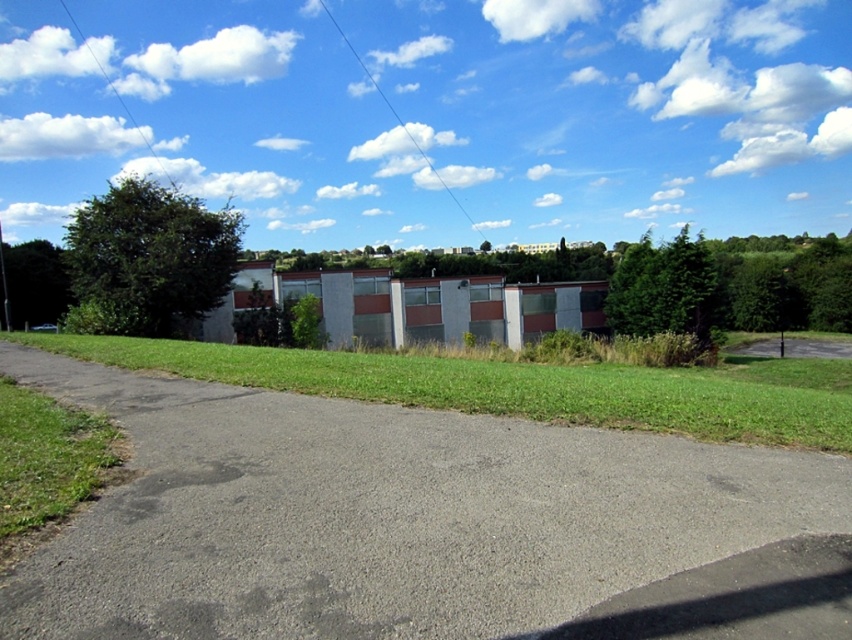
Question: Considering the real-world distances, which object is farthest from the green leafy tree at center-right?

Choices:
 (A) gray asphalt driveway at center
 (B) green asphalt driveway at lower right
 (C) green grass at lower center

Answer: (A)

Question: Which point appears farthest from the camera in this image?

Choices:
 (A) (776, 380)
 (B) (19, 275)
 (C) (357, 442)
 (D) (832, 336)

Answer: (D)

Question: Can you confirm if green grass at lower center is positioned above green leafy tree at upper left?

Choices:
 (A) yes
 (B) no

Answer: (B)

Question: Is green leafy tree at center-right positioned in front of green asphalt driveway at lower right?

Choices:
 (A) yes
 (B) no

Answer: (A)

Question: In this image, where is green leafy tree at center-right located relative to green asphalt driveway at lower right?

Choices:
 (A) below
 (B) above

Answer: (B)

Question: Which object appears closest to the camera in this image?

Choices:
 (A) green grass at lower center
 (B) green leafy tree at left

Answer: (A)